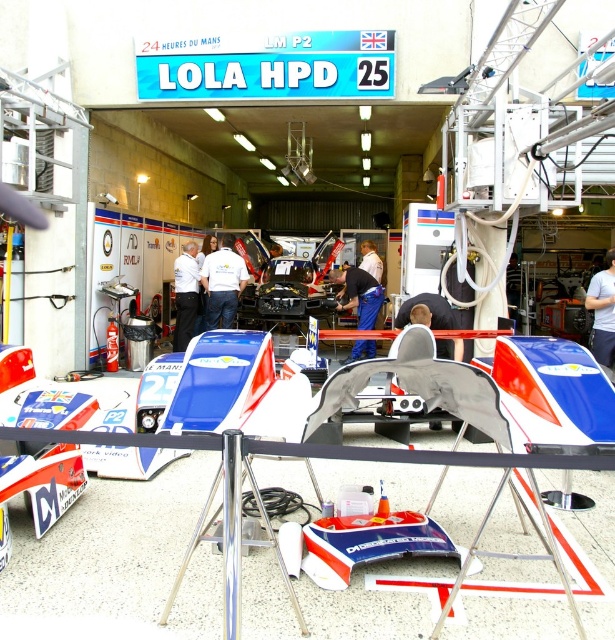
Does white shirt at center have a greater width compared to white fabric shirt at center?

Yes, white shirt at center is wider than white fabric shirt at center.

Which is behind, point (221, 298) or point (196, 282)?

The point (196, 282) is more distant.

This screenshot has height=640, width=615. Identify the location of white shirt at center. (223, 282).

Does point (223, 288) come in front of point (347, 288)?

No.

Locate an element on the screen. white shirt at center is located at coordinates (223, 282).

Can you confirm if blue fabric pants at center is taller than white fabric shirt at center?

Incorrect, blue fabric pants at center's height is not larger of white fabric shirt at center's.

Can you confirm if blue fabric pants at center is positioned above white fabric shirt at center?

No, blue fabric pants at center is not above white fabric shirt at center.

Who is more forward, (367, 328) or (180, 269)?

Point (367, 328)

The image size is (615, 640). Identify the location of blue fabric pants at center. (359, 294).